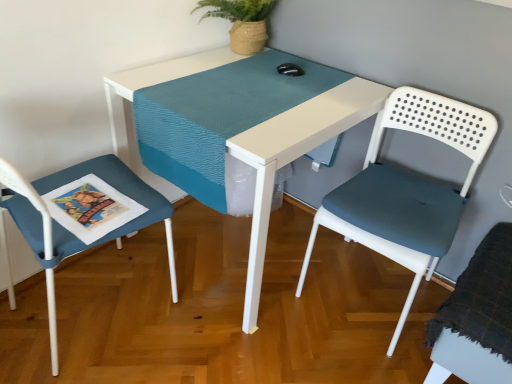
In order to click on vacant space that is in between textured blue cushion at left, which is the third chair from right to left, and white plastic table at center in this screenshot , I will do `click(159, 329)`.